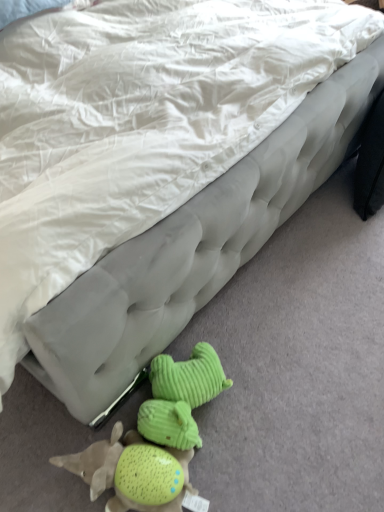
Identify the location of vacant area situated to the left side of green corduroy plush at lower left. (41, 455).